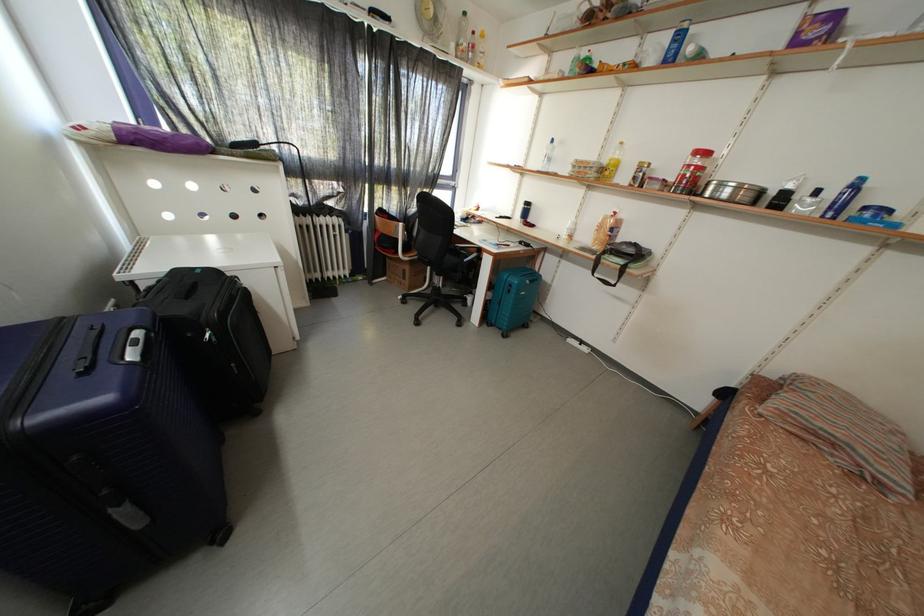
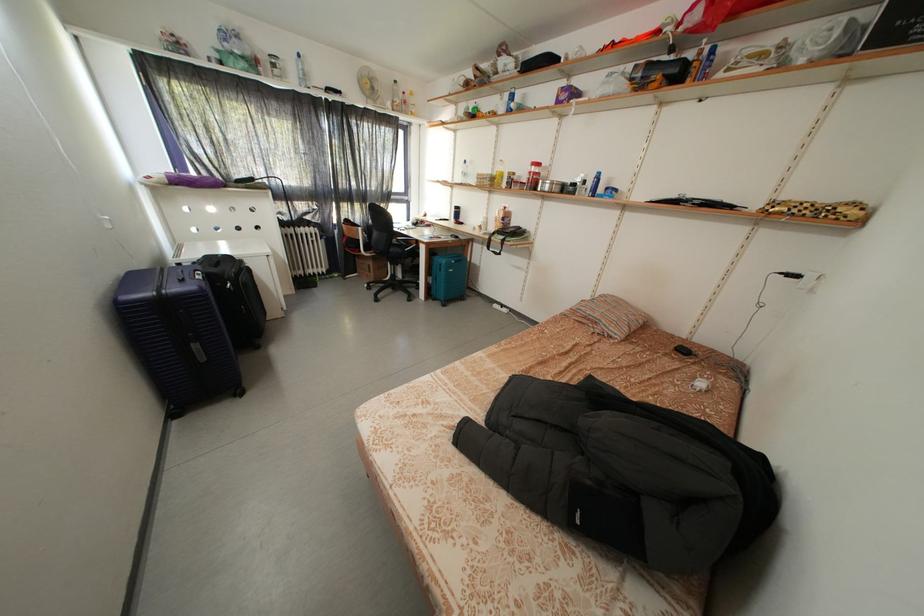
Locate, in the second image, the point that corresponds to (561,146) in the first image.

(472, 167)